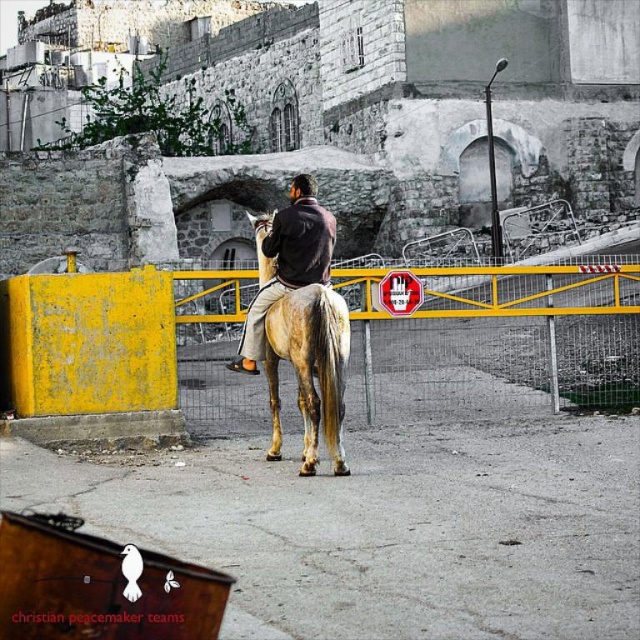
You are a photographer standing in the urban environment scene. You need to capture a photo of the dark brown leather jacket at center and the yellow metal fence at center. Based on their positions, which object should you adjust your camera to focus on first to ensure both are in the frame?

The yellow metal fence at center is positioned on the right side of dark brown leather jacket at center, so you should focus on the dark brown leather jacket at center first to ensure both are in the frame.

You are standing at the center of the image and want to walk towards the yellow metal fence at center. In which direction should you move?

The yellow metal fence at center is already at the center of the image, so you are already facing it directly. You don not need to move in any direction other than forward to reach it.